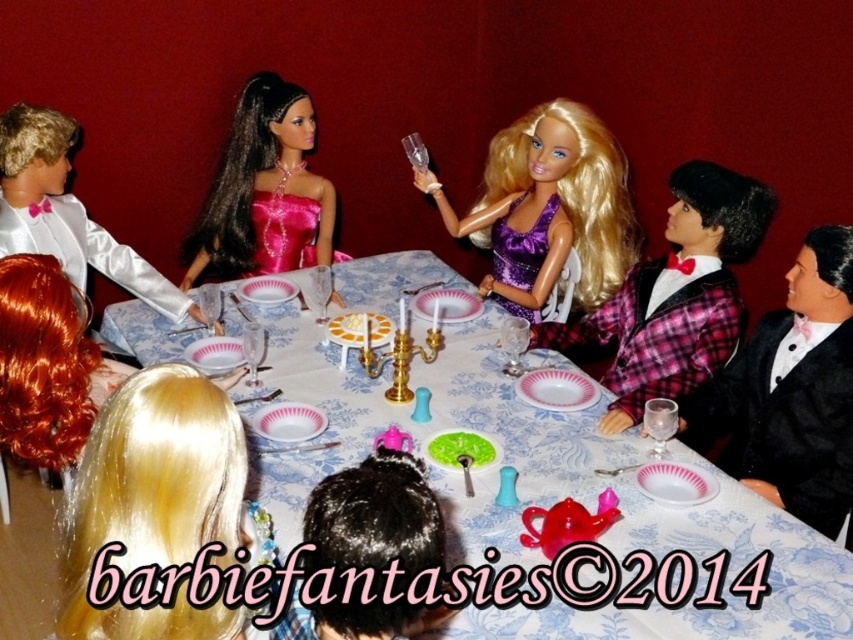
You are a guest at this formal dinner and need to place your napkin on the table. Considering the blue floral tablecloth at center and the black satin tuxedo at right, which object is higher and where should you place your napkin?

The blue floral tablecloth at center is much taller than the black satin tuxedo at right, so you should place your napkin on the tablecloth to ensure it stays elevated.